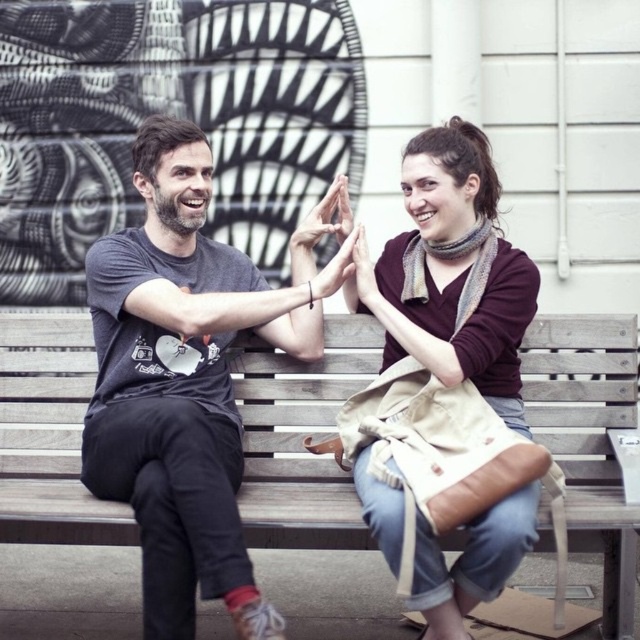
Question: Can you confirm if gray matte t-shirt at center is thinner than wooden bench at center?

Choices:
 (A) yes
 (B) no

Answer: (B)

Question: Is gray matte t-shirt at center smaller than maroon sweater at center?

Choices:
 (A) yes
 (B) no

Answer: (B)

Question: Among these objects, which one is farthest from the camera?

Choices:
 (A) wooden bench at center
 (B) maroon sweater at center
 (C) gray matte t-shirt at center

Answer: (B)

Question: Which of the following is the closest to the observer?

Choices:
 (A) wooden bench at center
 (B) gray matte t-shirt at center

Answer: (B)

Question: Considering the relative positions of gray matte t-shirt at center and maroon sweater at center in the image provided, where is gray matte t-shirt at center located with respect to maroon sweater at center?

Choices:
 (A) below
 (B) above

Answer: (A)

Question: Based on their relative distances, which object is nearer to the maroon sweater at center?

Choices:
 (A) wooden bench at center
 (B) gray matte t-shirt at center

Answer: (B)